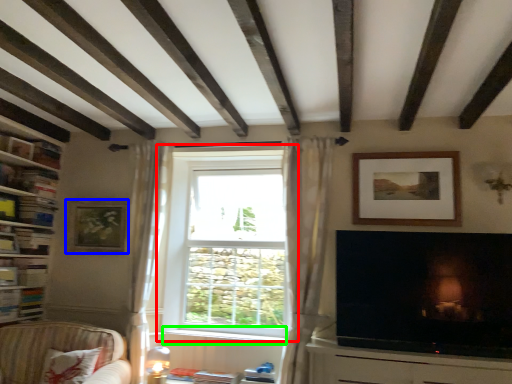
Question: Estimate the real-world distances between objects in this image. Which object is closer to window (highlighted by a red box), picture frame (highlighted by a blue box) or window sill (highlighted by a green box)?

Choices:
 (A) picture frame
 (B) window sill

Answer: (B)